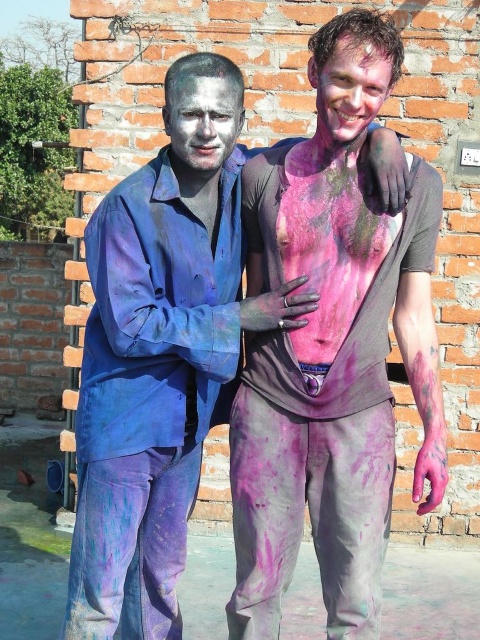
Question: Among these objects, which one is nearest to the camera?

Choices:
 (A) purple matte pants at lower left
 (B) matte pink paint at center
 (C) white matte face at center

Answer: (A)

Question: Does purple matte pants at lower left appear under matte pink paint at center?

Choices:
 (A) no
 (B) yes

Answer: (B)

Question: Is purple matte pants at lower left further to the viewer compared to matte pink paint at center?

Choices:
 (A) yes
 (B) no

Answer: (B)

Question: Which point is closer to the camera taking this photo?

Choices:
 (A) (352, 88)
 (B) (238, 172)
 (C) (219, 118)

Answer: (A)

Question: Is multicolored paint-covered body at center behind white matte face at center?

Choices:
 (A) no
 (B) yes

Answer: (A)

Question: Which point appears farthest from the camera in this image?

Choices:
 (A) (132, 404)
 (B) (226, 93)
 (C) (384, 420)
 (D) (333, 60)

Answer: (C)